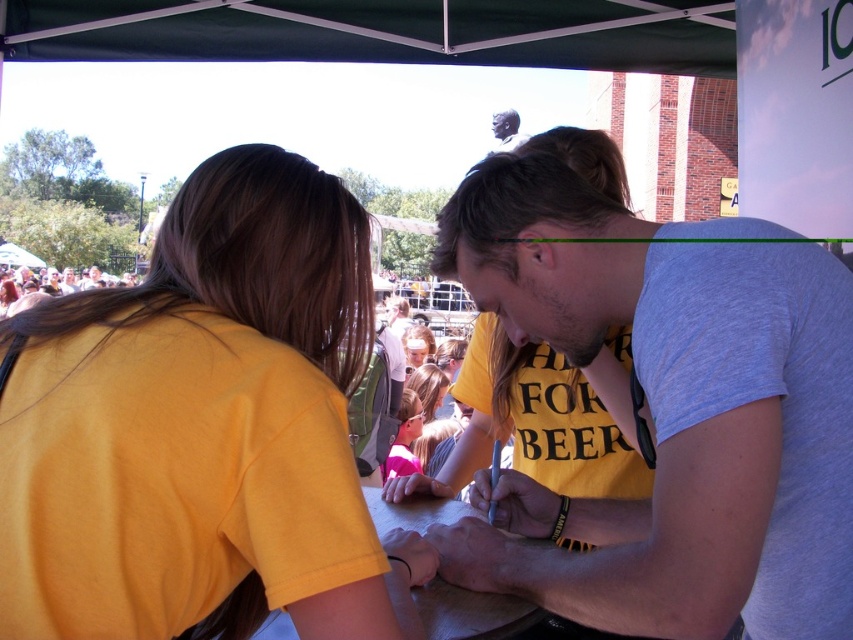
You are a photographer at the event and want to capture a photo of the matte black pen at center without any people in the frame. Given that you are standing 5.50 feet away from the pen, can you adjust your position to ensure no one is blocking the shot?

The photographer is 5.50 feet away from the matte black pen at center, which is the exact distance mentioned in the description. To avoid people blocking the shot, the photographer can move slightly to the side or adjust their angle while maintaining the required distance to frame the pen clearly without obstruction.